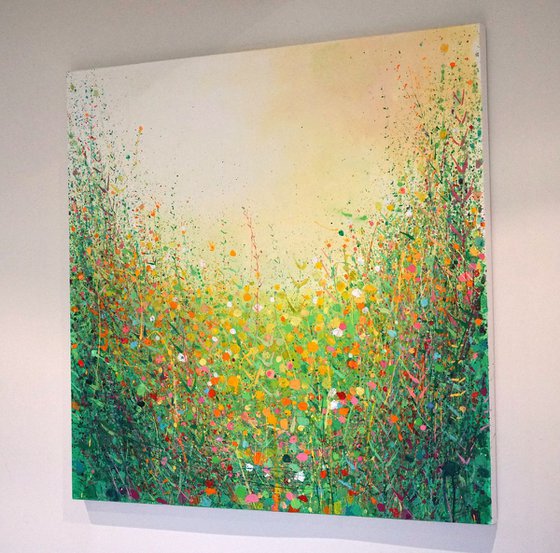
At what (x,y) coordinates should I click in order to perform the action: click on clear wall beneath painting at bottom. Please return your answer as a coordinate pair (x, y). Looking at the image, I should click on (157, 544).